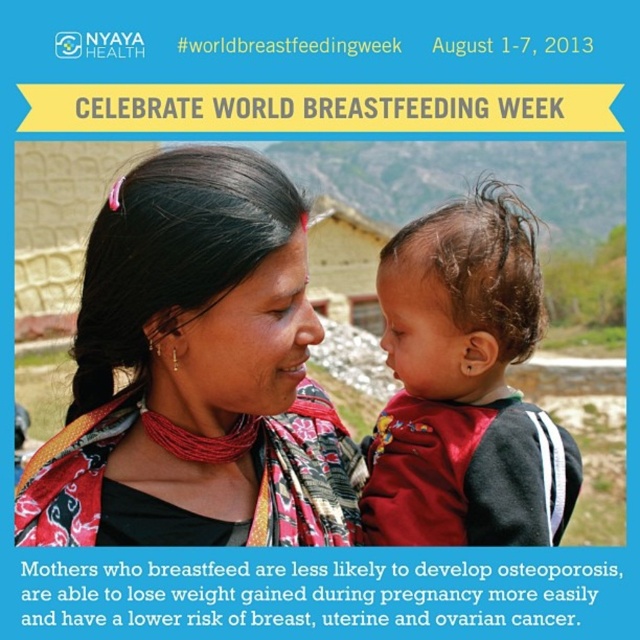
Looking at the promotional graphic for World Breastfeeding Week, you notice the multicolored fabric scarf at center and the curly brown hair at center. Which object is positioned to the left?

The multicolored fabric scarf at center is to the left of curly brown hair at center.

Looking at the promotional graphic for World Breastfeeding Week, you notice a woman holding a baby. She has curly brown hair at center and is wearing a multicolored fabric scarf at center. Which of these items is closer to you, the viewer?

The multicolored fabric scarf at center is in front of the curly brown hair at center, so the scarf is closer to the viewer.

Looking at the promotional graphic for World Breastfeeding Week, you notice the multicolored fabric scarf at center and the curly brown hair at center. Which object is shorter in height?

The multicolored fabric scarf at center has a lesser height compared to curly brown hair at center, so the multicolored fabric scarf at center is shorter.